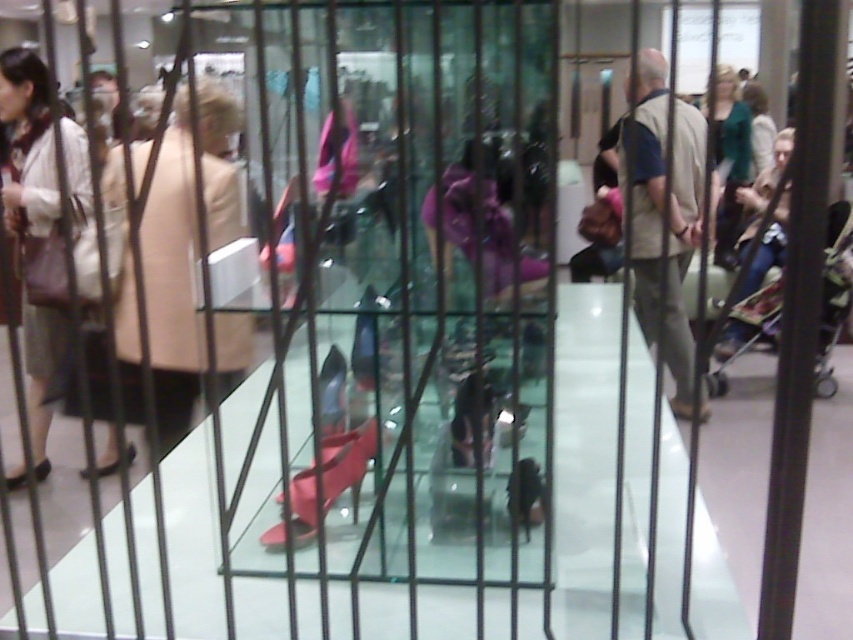
Is matte beige coat at left shorter than matte green sweater at upper right?

Correct, matte beige coat at left is not as tall as matte green sweater at upper right.

Is point (49, 180) positioned in front of point (730, 220)?

Yes.

The width and height of the screenshot is (853, 640). What do you see at coordinates (33, 228) in the screenshot? I see `matte beige coat at left` at bounding box center [33, 228].

Where is `matte beige coat at left`? The width and height of the screenshot is (853, 640). matte beige coat at left is located at coordinates (33, 228).